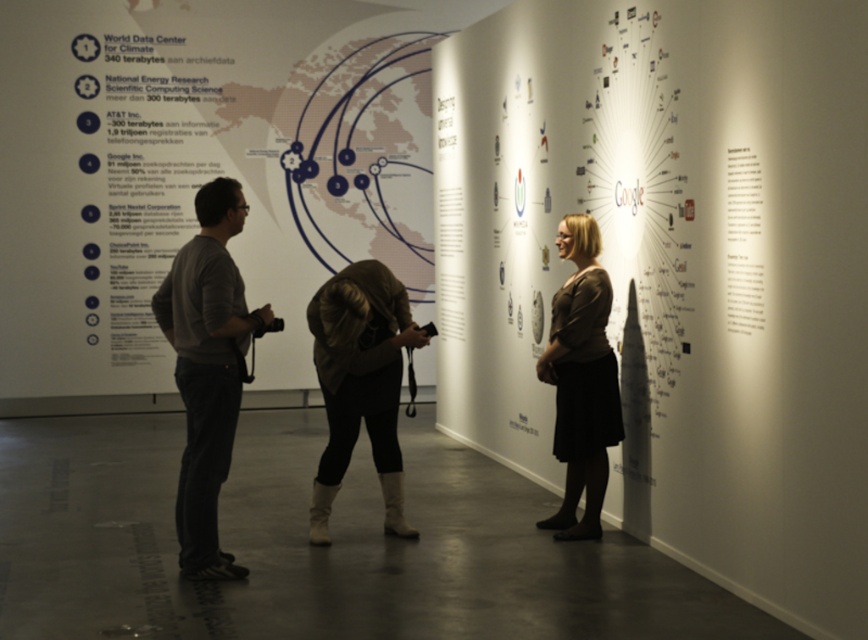
Question: Which object is closer to the camera taking this photo?

Choices:
 (A) gray cotton shirt at center
 (B) leather boots at center
 (C) dark brown sweater at center

Answer: (A)

Question: Which point is farther to the camera?

Choices:
 (A) dark brown sweater at center
 (B) gray cotton shirt at center

Answer: (A)

Question: Is gray cotton shirt at center bigger than dark brown sweater at center?

Choices:
 (A) no
 (B) yes

Answer: (B)

Question: Which object is the farthest from the leather boots at center?

Choices:
 (A) dark brown sweater at center
 (B) gray cotton shirt at center

Answer: (A)

Question: Does gray cotton shirt at center appear on the right side of leather boots at center?

Choices:
 (A) yes
 (B) no

Answer: (B)

Question: Does gray cotton shirt at center appear on the left side of leather boots at center?

Choices:
 (A) yes
 (B) no

Answer: (A)